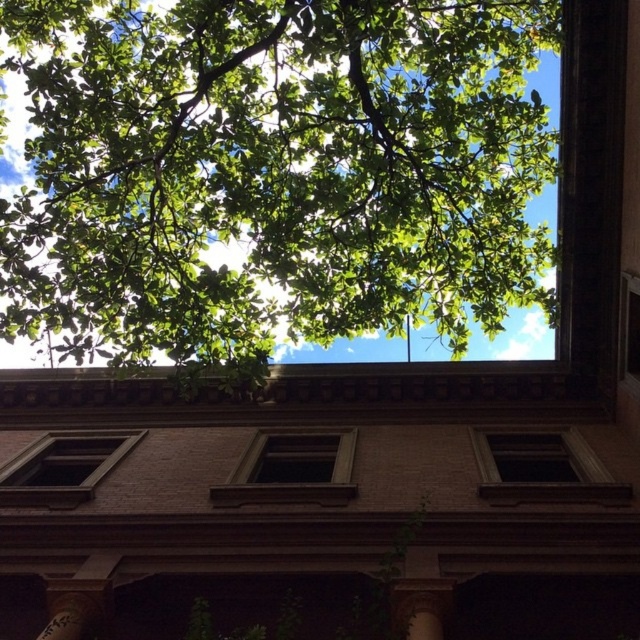
Question: Does green leafy tree at upper center have a larger size compared to matte brown window at center?

Choices:
 (A) no
 (B) yes

Answer: (B)

Question: Which object appears farthest from the camera in this image?

Choices:
 (A) brown wooden window at center
 (B) transparent glass window at center
 (C) green leafy tree at upper center
 (D) matte brown window at center

Answer: (A)

Question: Does transparent glass window at center come in front of matte brown window at center?

Choices:
 (A) no
 (B) yes

Answer: (B)

Question: Which object appears closest to the camera in this image?

Choices:
 (A) matte brown window at center
 (B) green leafy tree at upper center

Answer: (B)

Question: Can you confirm if transparent glass window at center is positioned above brown wooden window at center?

Choices:
 (A) no
 (B) yes

Answer: (B)

Question: Which object is the farthest from the green leafy tree at upper center?

Choices:
 (A) brown wooden window at center
 (B) transparent glass window at center

Answer: (B)